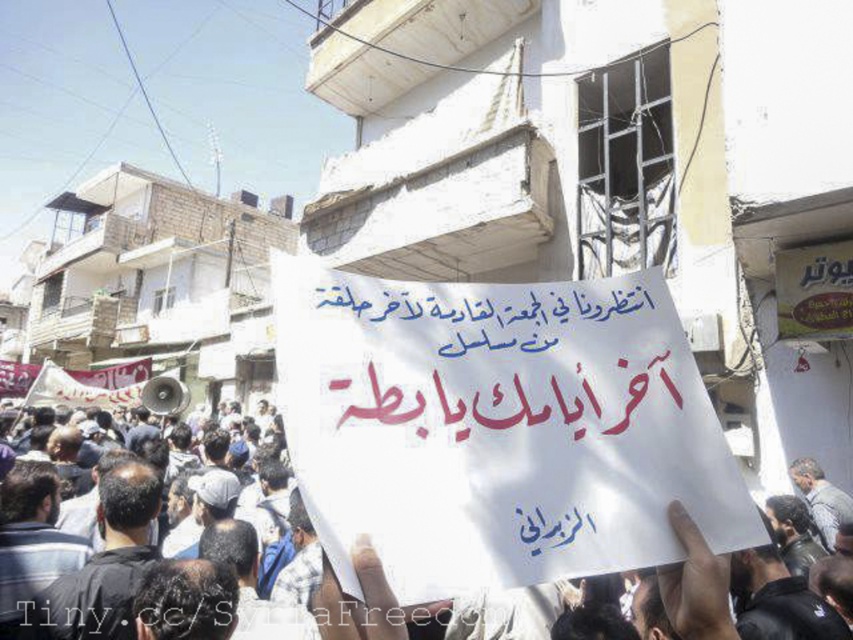
Does white paper sign at center appear over metallic megaphone at center-left?

Yes, white paper sign at center is above metallic megaphone at center-left.

Who is shorter, white paper sign at center or metallic megaphone at center-left?

white paper sign at center is shorter.

Between point (352, 608) and point (163, 388), which one is positioned in front?

Point (352, 608) is more forward.

The image size is (853, 640). I want to click on white paper sign at center, so click(697, 586).